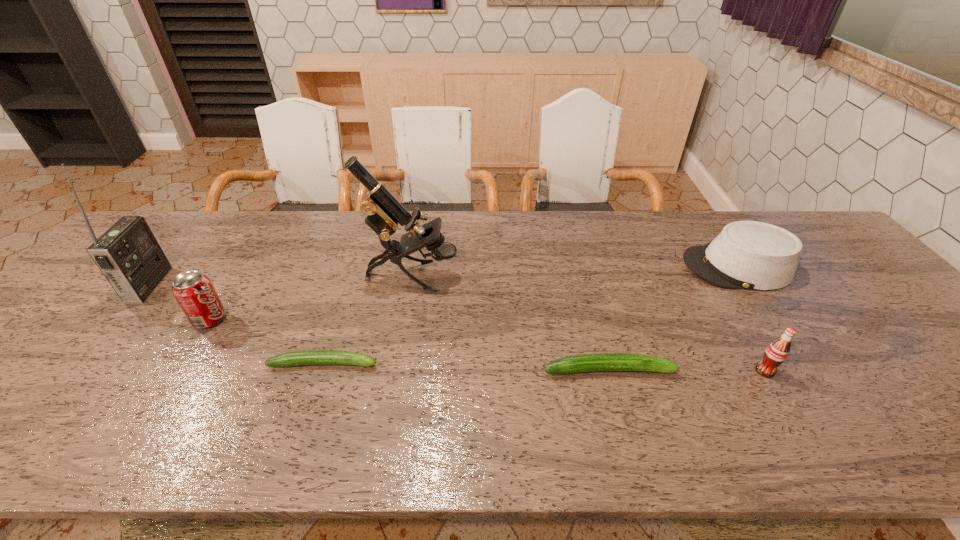
Find the location of a particular element. free space between the nearer soda and the right zucchini is located at coordinates (686, 370).

Image resolution: width=960 pixels, height=540 pixels. What are the coordinates of `vacant area that lies between the farther soda and the taller zucchini` in the screenshot? It's located at 409,345.

You are a GUI agent. You are given a task and a screenshot of the screen. Output one action in this format:
    pyautogui.click(x=<x>, y=<y>)
    Task: Click on the unoccupied area between the second shortest object and the microscope
    
    Given the screenshot: What is the action you would take?
    pyautogui.click(x=511, y=323)

At what (x,y) coordinates should I click in order to perform the action: click on empty space that is in between the third object from right to left and the microscope. Please return your answer as a coordinate pair (x, y). This screenshot has width=960, height=540. Looking at the image, I should click on [511, 323].

Identify the location of free point between the farther soda and the right zucchini. The height and width of the screenshot is (540, 960). (409, 345).

Find the location of a particular element. object that stands as the fourth closest to the shortest object is located at coordinates (128, 254).

Choose which object is the fifth nearest neighbor to the radio receiver. Please provide its 2D coordinates. Your answer should be formatted as a tuple, i.e. [(x, y)], where the tuple contains the x and y coordinates of a point satisfying the conditions above.

[(753, 255)]

Image resolution: width=960 pixels, height=540 pixels. What are the coordinates of `blank area in the image that satisfies the following two spatial constraints: 1. through the eyepiece of the right soda; 2. on the right side of the microscope` in the screenshot? It's located at (396, 371).

Locate an element on the screen. This screenshot has width=960, height=540. vacant space that satisfies the following two spatial constraints: 1. on the front-facing side of the hat; 2. on the front side of the nearer soda is located at coordinates (807, 371).

You are a GUI agent. You are given a task and a screenshot of the screen. Output one action in this format:
    pyautogui.click(x=<x>, y=<y>)
    Task: Click on the vacant region that satisfies the following two spatial constraints: 1. on the back side of the nearer soda; 2. on the front-facing side of the left zucchini
    The height and width of the screenshot is (540, 960).
    Given the screenshot: What is the action you would take?
    pyautogui.click(x=760, y=363)